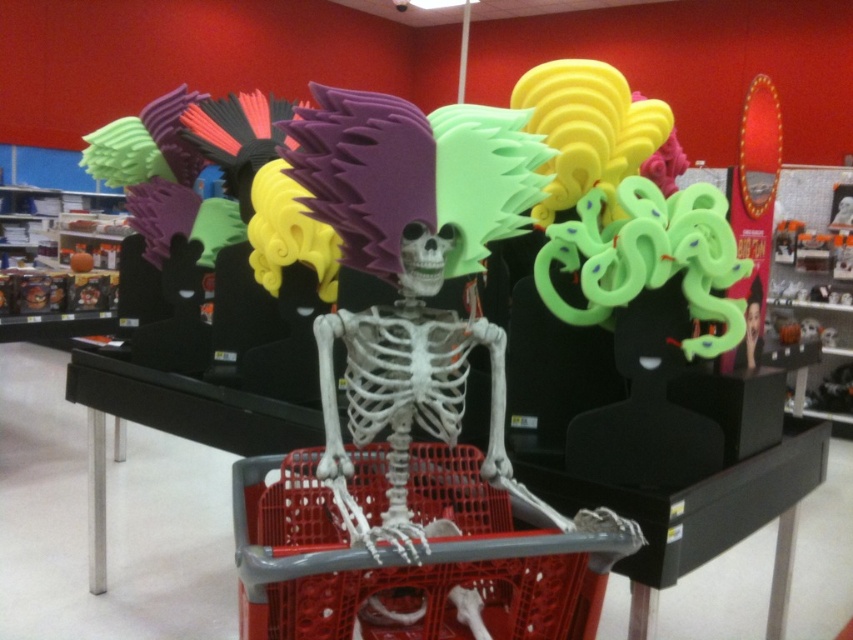
Question: Is red plastic shopping basket at center wider than smooth plastic skeleton at center?

Choices:
 (A) no
 (B) yes

Answer: (B)

Question: Is red plastic shopping basket at center below smooth plastic skeleton at center?

Choices:
 (A) no
 (B) yes

Answer: (B)

Question: In this image, where is red plastic shopping basket at center located relative to smooth plastic skeleton at center?

Choices:
 (A) left
 (B) right

Answer: (A)